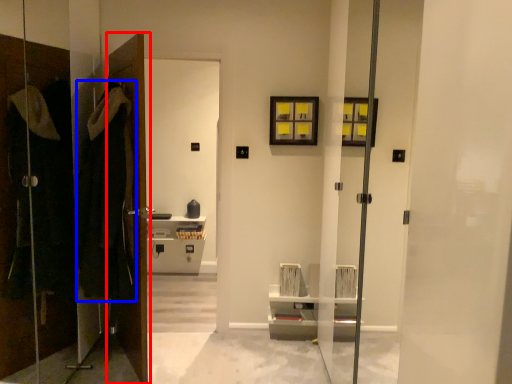
Question: Which object appears farthest to the camera in this image, door (highlighted by a red box) or robe (highlighted by a blue box)?

Choices:
 (A) door
 (B) robe

Answer: (A)